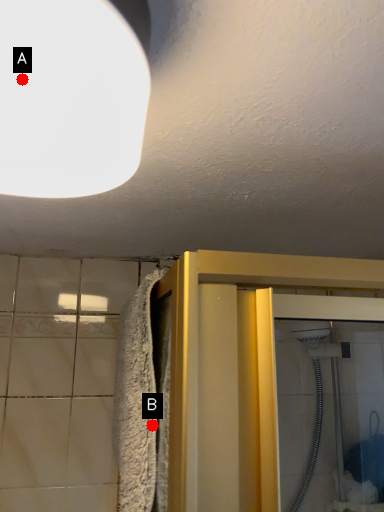
Question: Two points are circled on the image, labeled by A and B beside each circle. Which point is closer to the camera taking this photo?

Choices:
 (A) A is closer
 (B) B is closer

Answer: (A)